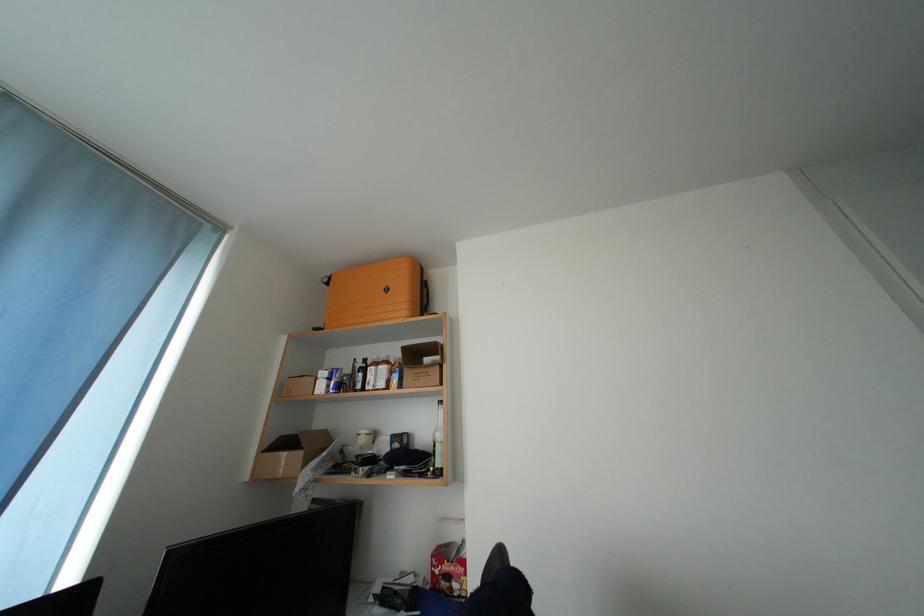
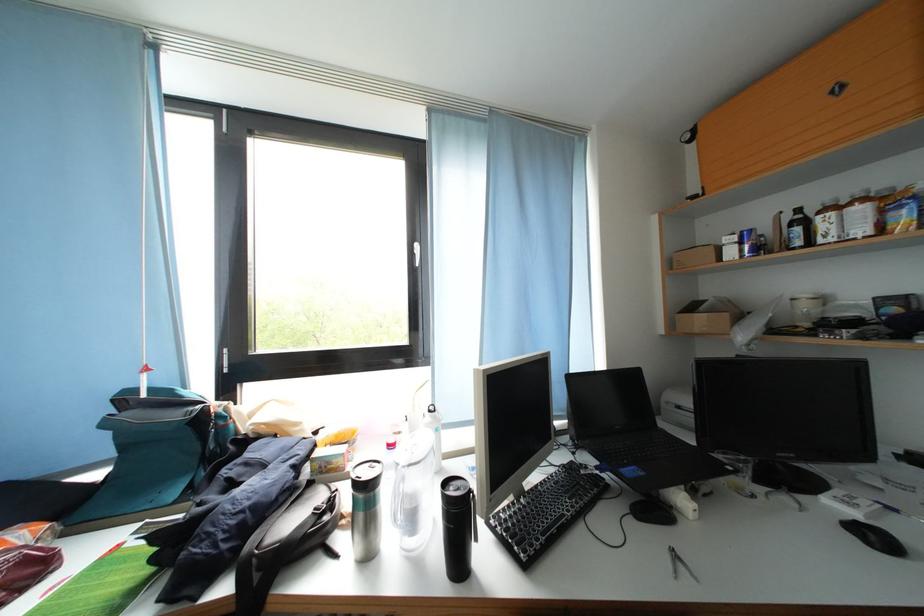
Where in the second image is the point corresponding to (369,379) from the first image?

(806, 233)